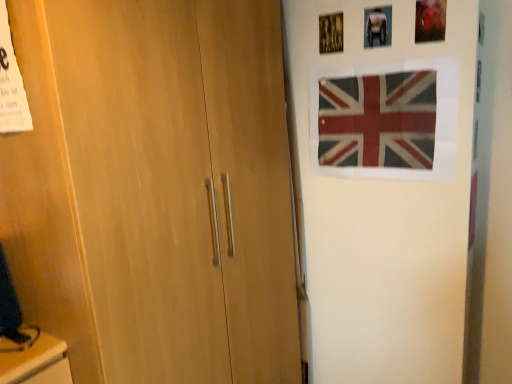
Question: Does white glossy picture frame at upper center have a smaller size compared to textured fabric flag at upper right?

Choices:
 (A) no
 (B) yes

Answer: (B)

Question: Is white glossy picture frame at upper center wider than textured fabric flag at upper right?

Choices:
 (A) no
 (B) yes

Answer: (B)

Question: Can textured fabric flag at upper right be found inside white glossy picture frame at upper center?

Choices:
 (A) no
 (B) yes

Answer: (A)

Question: Is white glossy picture frame at upper center positioned far away from textured fabric flag at upper right?

Choices:
 (A) yes
 (B) no

Answer: (B)

Question: Is white glossy picture frame at upper center positioned beyond the bounds of textured fabric flag at upper right?

Choices:
 (A) no
 (B) yes

Answer: (B)

Question: From the image's perspective, does white glossy picture frame at upper center appear lower than textured fabric flag at upper right?

Choices:
 (A) no
 (B) yes

Answer: (A)

Question: Is textured fabric flag at upper right completely or partially outside of white glossy picture frame at upper center?

Choices:
 (A) yes
 (B) no

Answer: (A)

Question: From a real-world perspective, is textured fabric flag at upper right below white glossy picture frame at upper center?

Choices:
 (A) no
 (B) yes

Answer: (B)

Question: Can you confirm if textured fabric flag at upper right is smaller than white glossy picture frame at upper center?

Choices:
 (A) yes
 (B) no

Answer: (B)

Question: Is textured fabric flag at upper right looking in the opposite direction of white glossy picture frame at upper center?

Choices:
 (A) no
 (B) yes

Answer: (A)

Question: Does textured fabric flag at upper right appear on the right side of white glossy picture frame at upper center?

Choices:
 (A) yes
 (B) no

Answer: (A)

Question: Is textured fabric flag at upper right to the left of white glossy picture frame at upper center from the viewer's perspective?

Choices:
 (A) no
 (B) yes

Answer: (A)

Question: Which is correct: white glossy picture frame at upper center is inside textured fabric flag at upper right, or outside of it?

Choices:
 (A) inside
 (B) outside

Answer: (B)